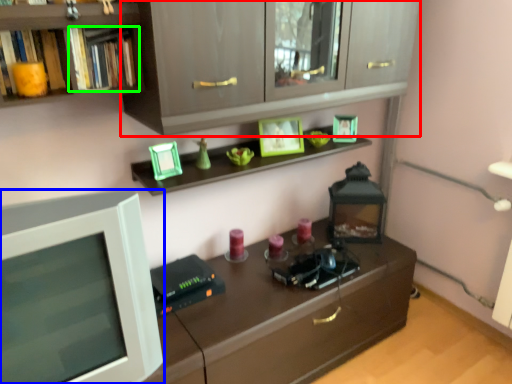
Question: Which object is positioned farthest from cabinetry (highlighted by a red box)? Select from computer monitor (highlighted by a blue box) and book (highlighted by a green box).

Choices:
 (A) computer monitor
 (B) book

Answer: (A)